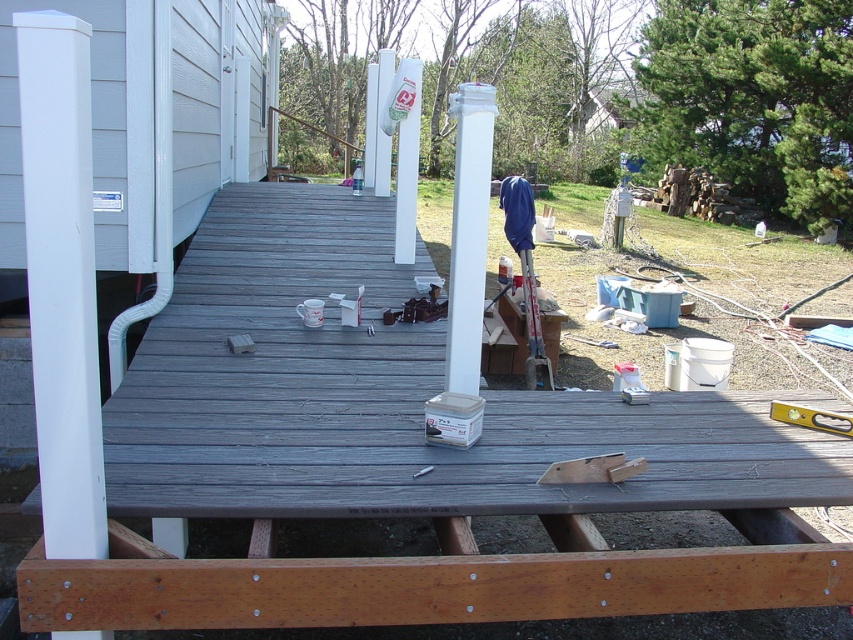
Can you confirm if white painted wood post at left is positioned to the right of white glossy post at center?

Incorrect, white painted wood post at left is not on the right side of white glossy post at center.

What do you see at coordinates (61, 280) in the screenshot? The image size is (853, 640). I see `white painted wood post at left` at bounding box center [61, 280].

At what (x,y) coordinates should I click in order to perform the action: click on white painted wood post at left. Please return your answer as a coordinate pair (x, y). The image size is (853, 640). Looking at the image, I should click on (61, 280).